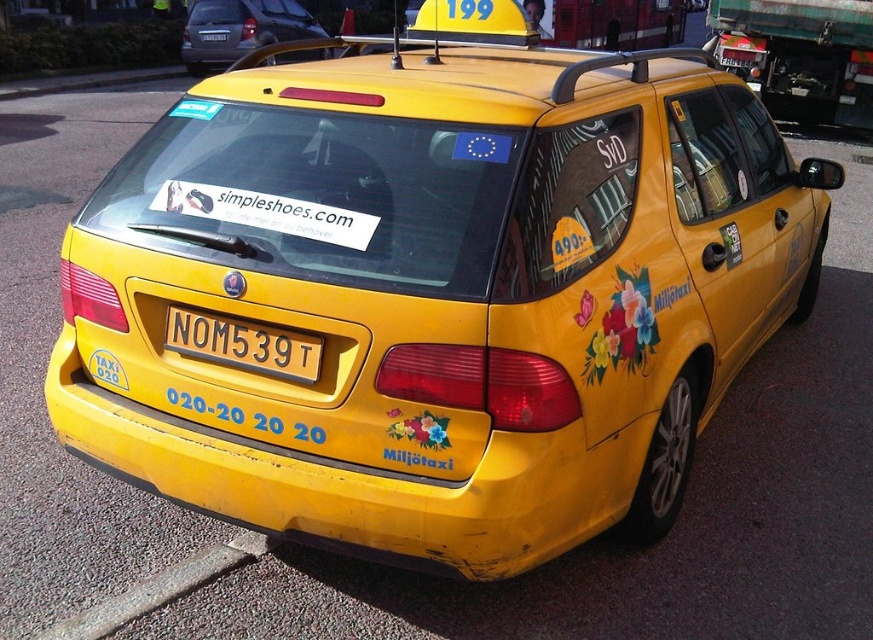
Question: Can you confirm if yellow matte taxi at upper center is positioned to the left of gray asphalt curb at lower left?

Choices:
 (A) no
 (B) yes

Answer: (B)

Question: Estimate the real-world distances between objects in this image. Which object is farther from the yellow matte taxi at upper center?

Choices:
 (A) yellow plastic license plate at center
 (B) gray asphalt curb at lower left

Answer: (B)

Question: Which of these objects is positioned farthest from the yellow plastic license plate at center?

Choices:
 (A) gray asphalt curb at lower left
 (B) yellow matte taxi at upper center

Answer: (B)

Question: Does yellow matte taxi at upper center have a larger size compared to yellow plastic license plate at center?

Choices:
 (A) no
 (B) yes

Answer: (B)

Question: Is yellow matte taxi at upper center bigger than yellow plastic license plate at center?

Choices:
 (A) no
 (B) yes

Answer: (B)

Question: Which object appears closest to the camera in this image?

Choices:
 (A) yellow plastic license plate at center
 (B) gray asphalt curb at lower left
 (C) yellow matte taxi at upper center

Answer: (A)